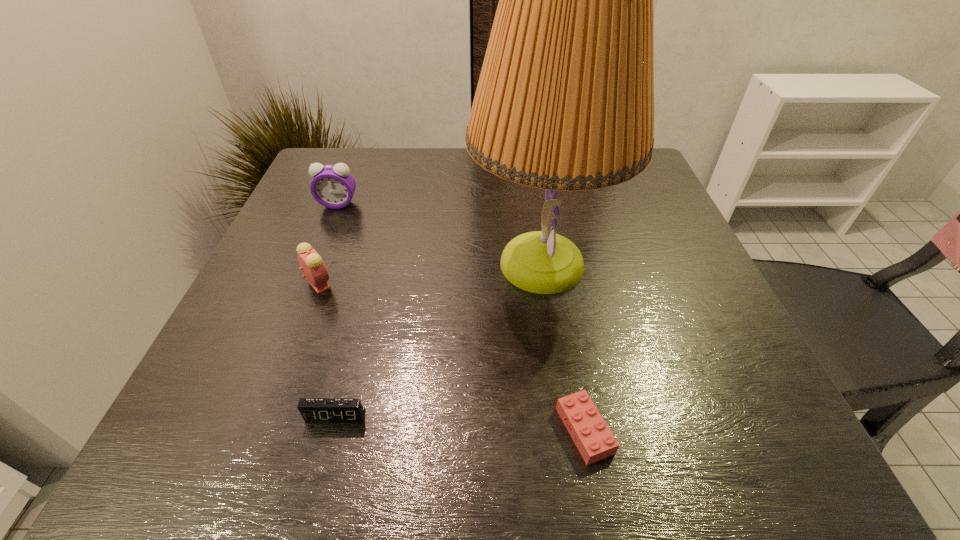
Identify the location of the tallest object. Image resolution: width=960 pixels, height=540 pixels. (565, 100).

You are a GUI agent. You are given a task and a screenshot of the screen. Output one action in this format:
    pyautogui.click(x=<x>, y=<y>)
    Task: Click on the tallest alarm clock
    The height and width of the screenshot is (540, 960).
    Given the screenshot: What is the action you would take?
    pyautogui.click(x=333, y=186)

In order to click on the fourth shortest object in this screenshot , I will do `click(333, 186)`.

This screenshot has width=960, height=540. Identify the location of the second shortest alarm clock. (311, 263).

Where is `the third shortest object`? Image resolution: width=960 pixels, height=540 pixels. the third shortest object is located at coordinates (311, 263).

Image resolution: width=960 pixels, height=540 pixels. Identify the location of the third object from left to right. (311, 409).

You are a GUI agent. You are given a task and a screenshot of the screen. Output one action in this format:
    pyautogui.click(x=<x>, y=<y>)
    Task: Click on the nearest alarm clock
    This screenshot has width=960, height=540.
    Given the screenshot: What is the action you would take?
    pyautogui.click(x=311, y=409)

You are a GUI agent. You are given a task and a screenshot of the screen. Output one action in this format:
    pyautogui.click(x=<x>, y=<y>)
    Task: Click on the Lego
    Image resolution: width=960 pixels, height=540 pixels.
    Given the screenshot: What is the action you would take?
    pyautogui.click(x=593, y=438)

In order to click on free space located on the side of the lamp near the pull switch in this screenshot , I will do `click(290, 264)`.

Find the location of a particular element. vacant area located 0.320m on the side of the lamp near the pull switch is located at coordinates (314, 264).